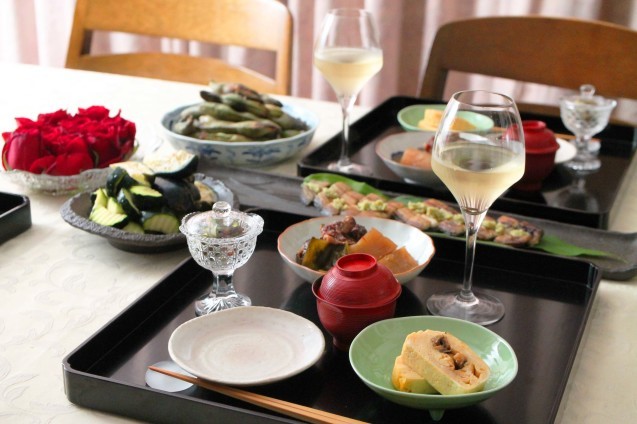
This screenshot has height=424, width=637. I want to click on clean dish, so click(271, 342), click(569, 144).